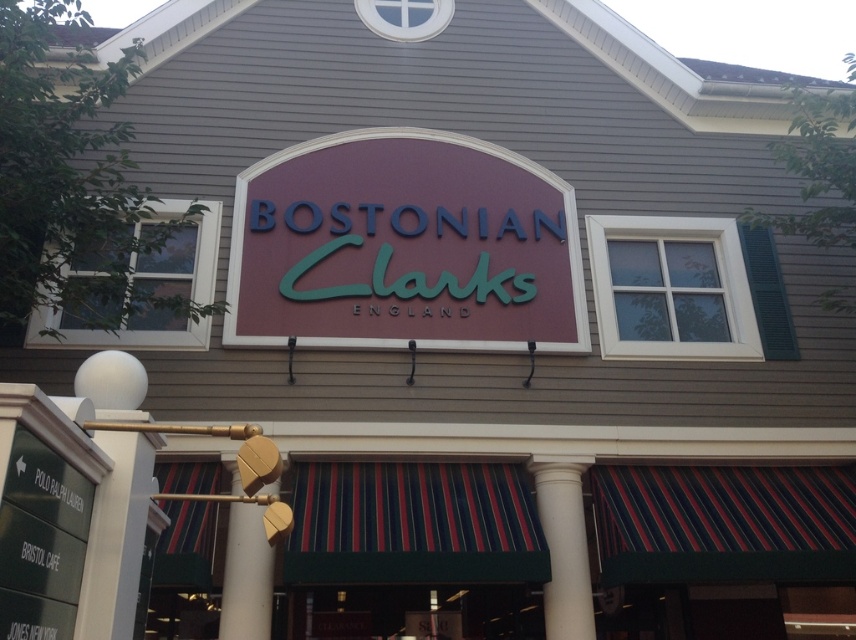
You are standing at the entrance of the Bostonian Clarks England store. You see two points marked on the awning. The first point is at coordinates point (x=482, y=276) and the second is at point (x=259, y=636). Which point is closer to you?

Point (x=259, y=636) is closer to you because it is in front of point (x=482, y=276).

You are standing in front of the Bostonian Clarks England store. Where is the matte maroon sign at center located in relation to the entrance?

The matte maroon sign at center is located at point (403, 248), which is near the entrance of the store.

You are standing in front of the Bostonian Clarks England store. You want to locate the matte maroon sign at center. Where should you look relative to the entrance?

The matte maroon sign at center is located at point (403, 248) relative to the entrance.